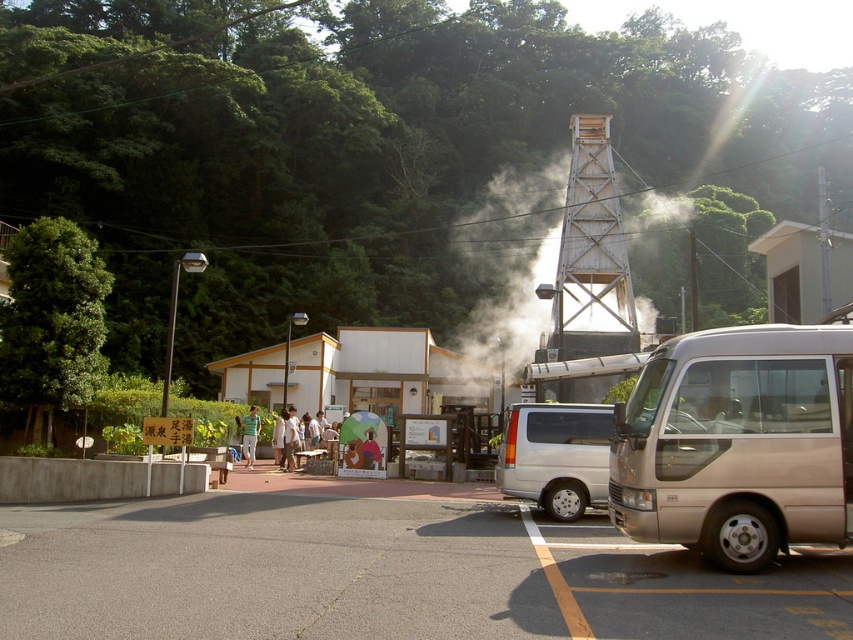
Question: Is wooden lattice tower at center further to the viewer compared to green fabric umbrella at center?

Choices:
 (A) no
 (B) yes

Answer: (A)

Question: Can you confirm if gold metallic van at right is positioned to the left of green fabric umbrella at center?

Choices:
 (A) yes
 (B) no

Answer: (B)

Question: Which of these objects is positioned farthest from the gold metallic van at right?

Choices:
 (A) white smoke at center
 (B) wooden lattice tower at center
 (C) green fabric umbrella at center

Answer: (A)

Question: Which object is farther from the camera taking this photo?

Choices:
 (A) gold metallic van at right
 (B) white smoke at center
 (C) wooden lattice tower at center
 (D) green fabric umbrella at center

Answer: (B)

Question: Can you confirm if wooden lattice tower at center is positioned below green fabric umbrella at center?

Choices:
 (A) yes
 (B) no

Answer: (B)

Question: Which point is closer to the camera taking this photo?

Choices:
 (A) (560, 234)
 (B) (595, 396)
 (C) (662, 362)
 (D) (251, 406)

Answer: (C)